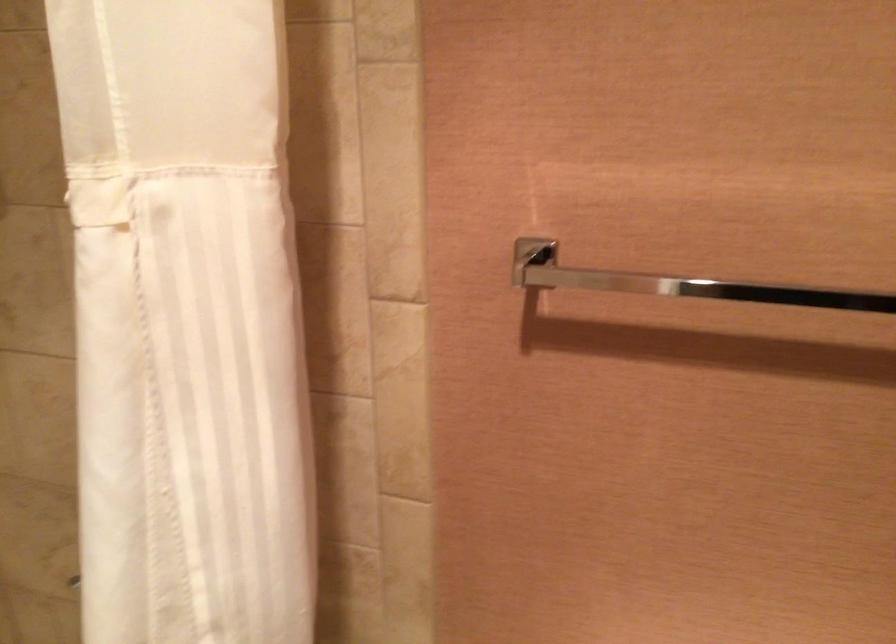
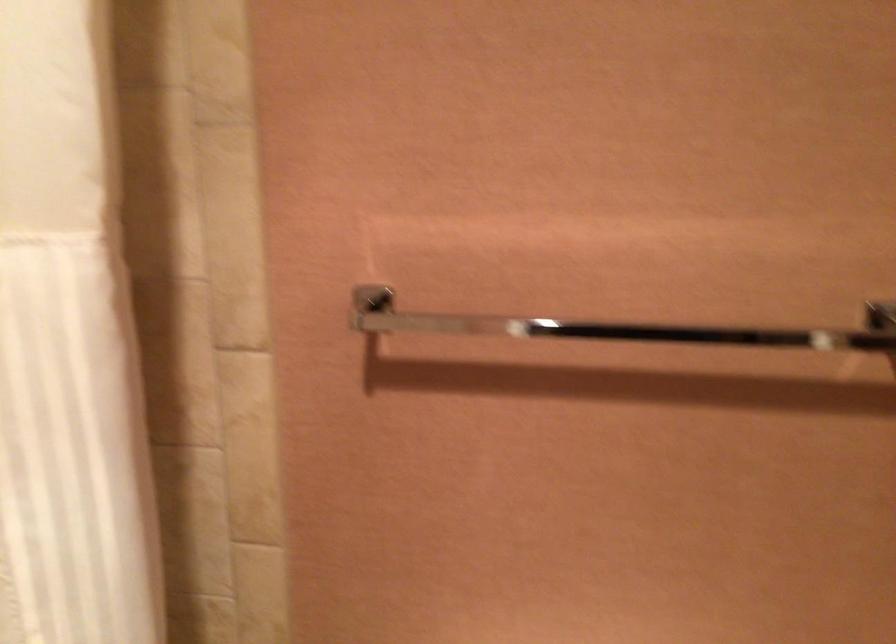
The point at (821, 292) is marked in the first image. Where is the corresponding point in the second image?

(616, 327)